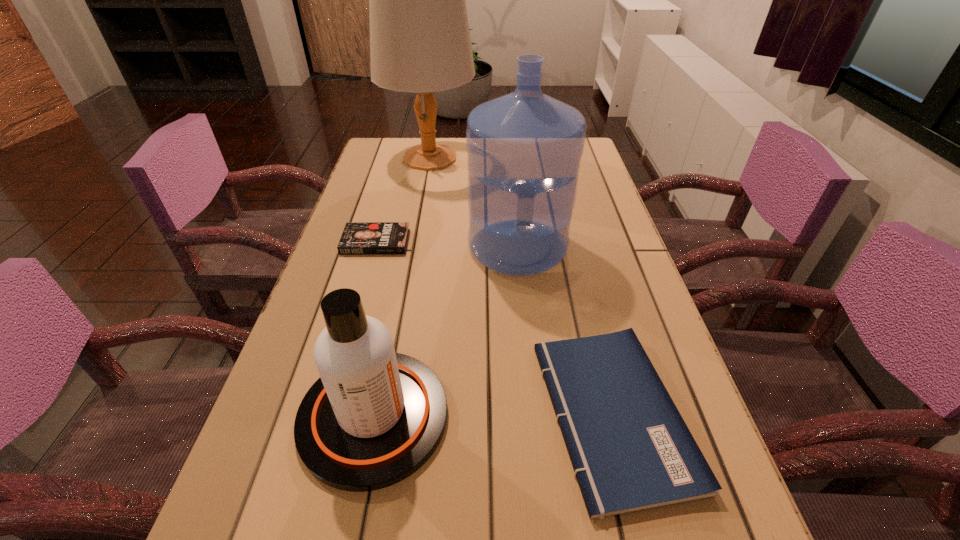
The height and width of the screenshot is (540, 960). I want to click on the farthest object, so click(420, 42).

Locate an element on the screen. This screenshot has width=960, height=540. water jug is located at coordinates (524, 149).

Where is `the third tallest object`? This screenshot has height=540, width=960. the third tallest object is located at coordinates (374, 417).

Locate an element on the screen. The image size is (960, 540). the fourth tallest object is located at coordinates (630, 448).

Locate an element on the screen. The image size is (960, 540). the shortest object is located at coordinates (358, 238).

This screenshot has width=960, height=540. I want to click on free space located on the front of the table lamp, so click(x=424, y=190).

Find the location of `vacant space located 0.230m on the side of the water jug with the handle`. vacant space located 0.230m on the side of the water jug with the handle is located at coordinates (529, 360).

You are a GUI agent. You are given a task and a screenshot of the screen. Output one action in this format:
    pyautogui.click(x=<x>, y=<y>)
    Task: Click on the free region located 0.350m on the back of the third shortest object
    This screenshot has height=540, width=960.
    Given the screenshot: What is the action you would take?
    pyautogui.click(x=407, y=245)

You are a GUI agent. You are given a task and a screenshot of the screen. Output one action in this format:
    pyautogui.click(x=<x>, y=<y>)
    Task: Click on the vacant space positioned 0.120m on the back of the fourth tallest object
    
    Given the screenshot: What is the action you would take?
    pyautogui.click(x=584, y=295)

This screenshot has height=540, width=960. In order to click on free space located on the front of the book in this screenshot , I will do `click(351, 325)`.